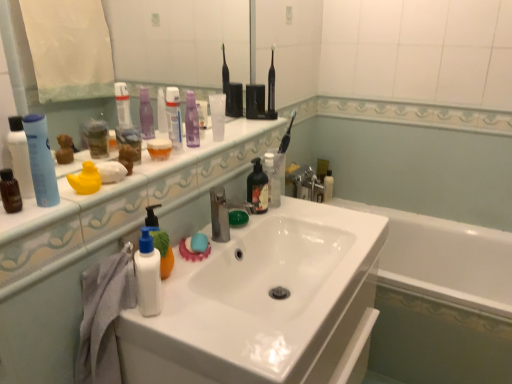
This screenshot has width=512, height=384. I want to click on unoccupied region to the right of white matte lotion at center, the 2th toiletry when ordered from front to back, so click(208, 320).